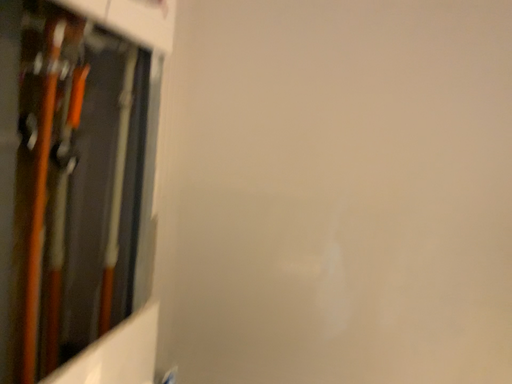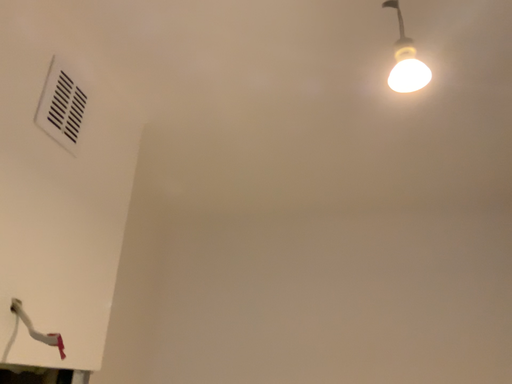
Question: How did the camera likely rotate when shooting the video?

Choices:
 (A) rotated downward
 (B) rotated upward

Answer: (B)